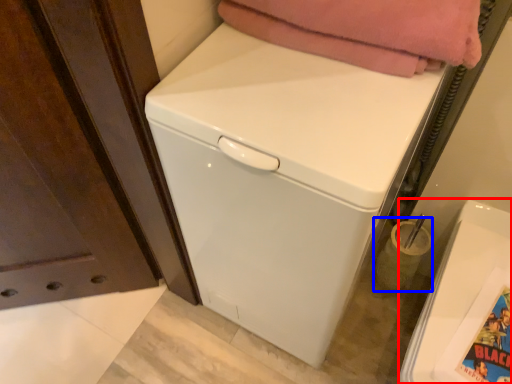
Question: Which of the following is the farthest to the observer, washing machine (highlighted by a red box) or appliance (highlighted by a blue box)?

Choices:
 (A) washing machine
 (B) appliance

Answer: (B)